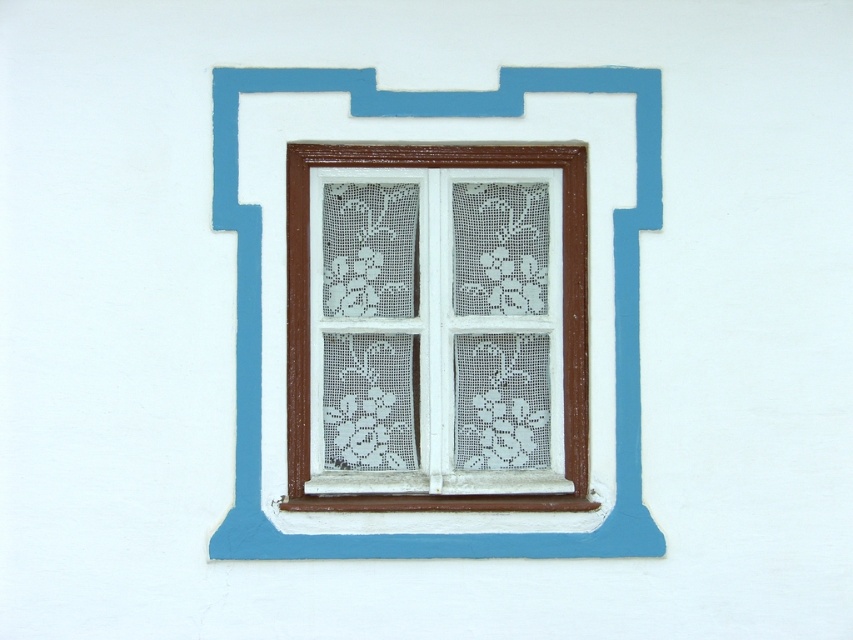
You are an interior designer planning to install a new decorative border around the white lace curtain at center and the brown wood window frame at center. Based on their sizes, which object should you consider first to ensure the border accommodates both?

The white lace curtain at center has a lesser height compared to the brown wood window frame at center, so you should first consider the brown wood window frame at center since it is taller and will require a border that can accommodate its height to ensure both are properly framed.

You are standing in a room and looking at the white lace curtain at center. If the room is 6 meters long, can you walk from where you are to the curtain without needing to move backward?

The white lace curtain at center is 6.12 meters away from the camera, so it is 12 centimeters beyond the room length. Therefore, you cannot reach it without moving backward.

You are an interior designer planning to install a new decorative border around the window. The border must fit snugly around both the white lace curtain at center and the brown wood window frame at center. Based on their sizes, which object should the border be designed to accommodate first?

The border should be designed to accommodate the white lace curtain at center first because it has a larger size compared to the brown wood window frame at center, ensuring the border fits snugly around both.